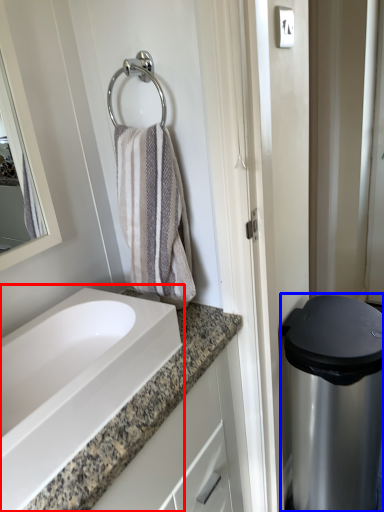
Question: Which object is further to the camera taking this photo, sink (highlighted by a red box) or appliance (highlighted by a blue box)?

Choices:
 (A) sink
 (B) appliance

Answer: (B)